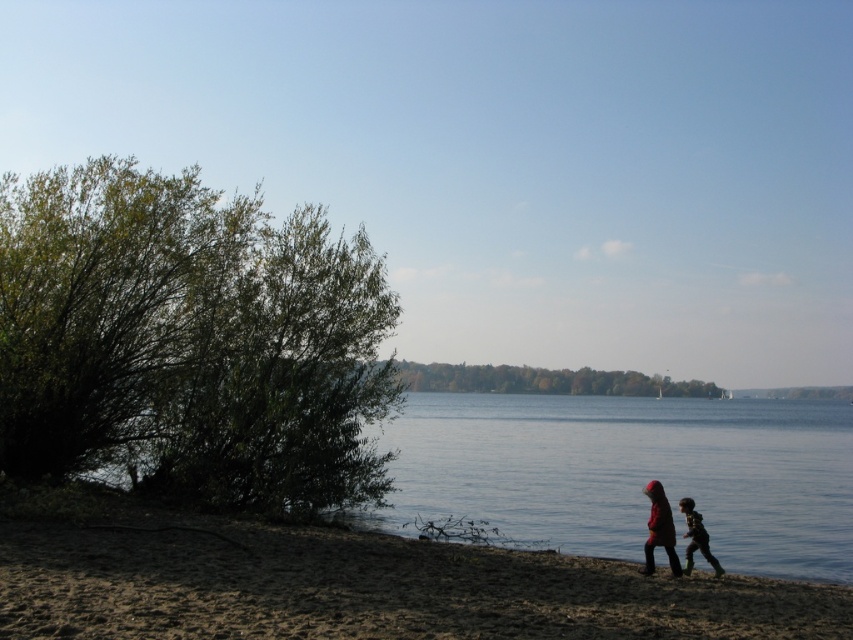
You are standing at the edge of the lake and see two points marked on the ground. One is labeled as point (479, 636) and the other as point (700, 529). Which point is closer to you?

Point (479, 636) is in front of point (700, 529), so it is closer to you.

You are standing on the brown sandy beach at lower left and want to move towards the green leafy bush at left. Which direction should you walk to reach it?

The green leafy bush at left is positioned on the left side of the brown sandy beach at lower left, so you should walk to the left to reach it.